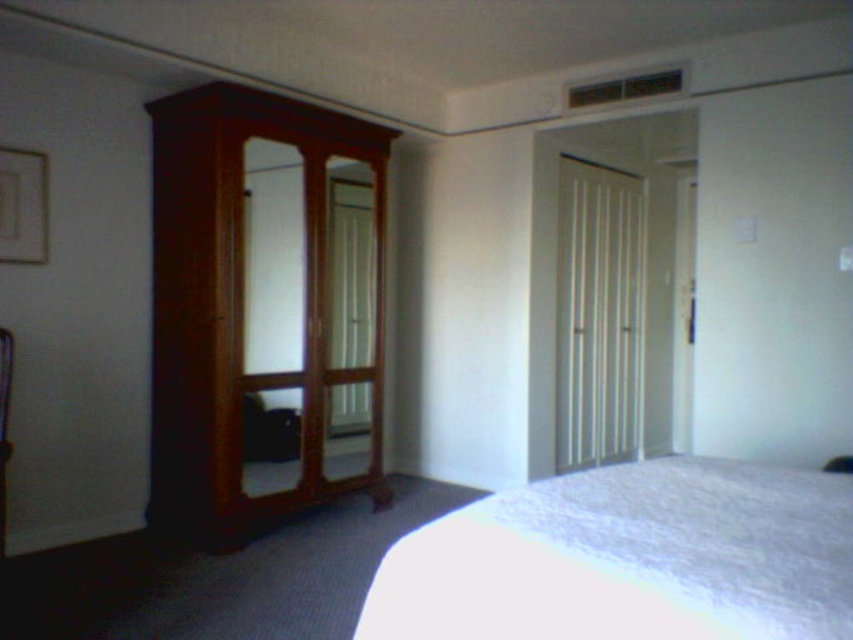
Question: Can you confirm if wooden mirror at left is wider than wooden mirror at center?

Choices:
 (A) yes
 (B) no

Answer: (A)

Question: Is mahogany wood dresser at left below wooden mirror at center?

Choices:
 (A) yes
 (B) no

Answer: (A)

Question: Which point is farther to the camera?

Choices:
 (A) mahogany wood dresser at left
 (B) white fluffy bed at lower right

Answer: (A)

Question: Considering the real-world distances, which object is farthest from the white fluffy bed at lower right?

Choices:
 (A) wooden mirror at center
 (B) mahogany wood dresser at left
 (C) wooden mirror at left

Answer: (A)

Question: Which point appears closest to the camera in this image?

Choices:
 (A) (277, 157)
 (B) (341, 209)
 (C) (595, 490)
 (D) (364, 390)

Answer: (C)

Question: Does mahogany wood dresser at left have a smaller size compared to white fluffy bed at lower right?

Choices:
 (A) no
 (B) yes

Answer: (A)